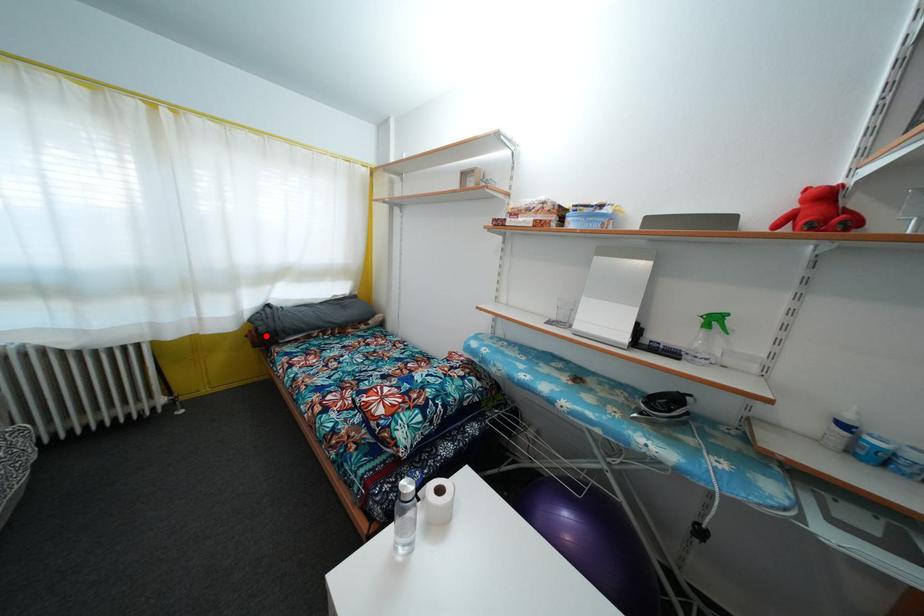
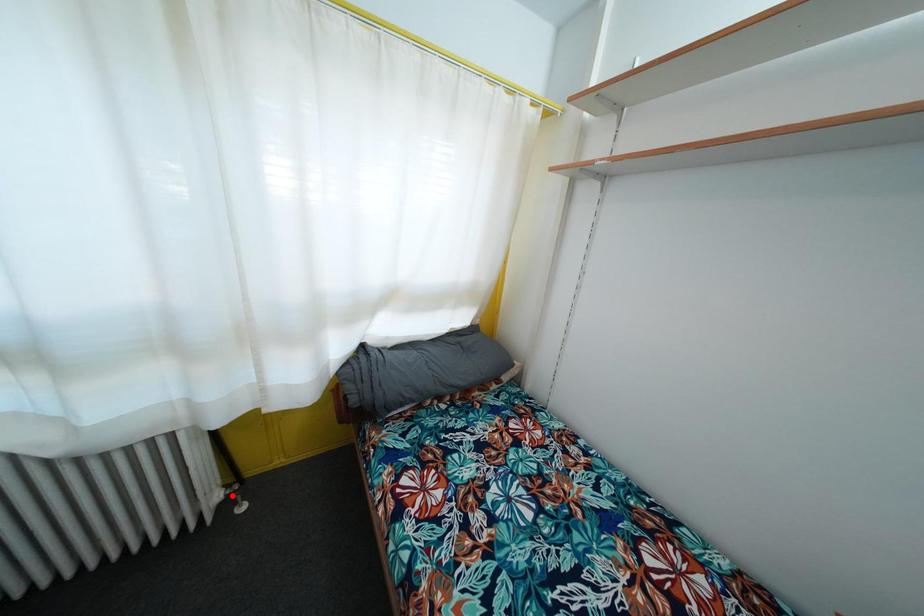
I am providing you with two images of the same scene from different viewpoints. A red point is marked on the first image and another point is marked on the second image. Are the points marked in image1 and image2 representing the same 3D position?

No